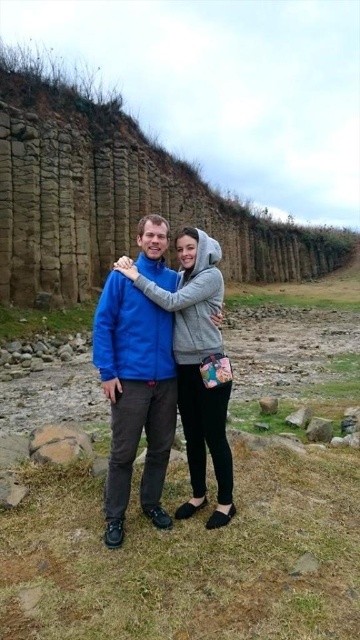
Question: Does blue fleece jacket at center have a lesser width compared to gray rough stone at lower right?

Choices:
 (A) no
 (B) yes

Answer: (A)

Question: Which object appears closest to the camera in this image?

Choices:
 (A) gray rough stone at lower right
 (B) blue fleece jacket at center

Answer: (B)

Question: Which point is farther to the camera?

Choices:
 (A) blue fleece jacket at center
 (B) gray rough stone at lower right

Answer: (B)

Question: Does blue fleece jacket at center have a lesser width compared to gray rough stone at lower right?

Choices:
 (A) no
 (B) yes

Answer: (A)

Question: Is blue fleece jacket at center thinner than gray rough stone at lower right?

Choices:
 (A) no
 (B) yes

Answer: (A)